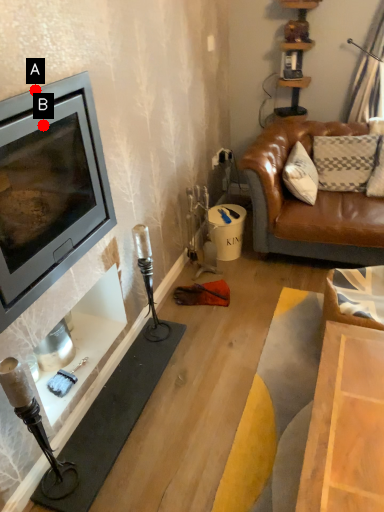
Question: Two points are circled on the image, labeled by A and B beside each circle. Which point is closer to the camera taking this photo?

Choices:
 (A) A is closer
 (B) B is closer

Answer: (A)